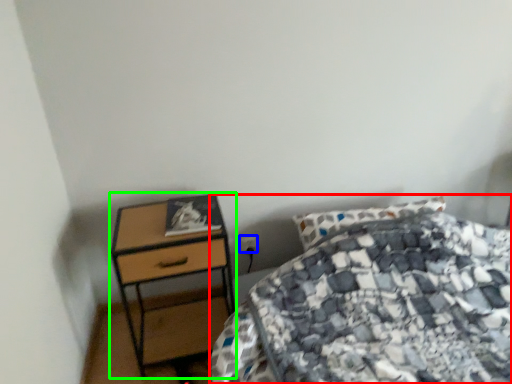
Question: Which is nearer to the bed (highlighted by a red box)? power plugs and sockets (highlighted by a blue box) or nightstand (highlighted by a green box).

Choices:
 (A) power plugs and sockets
 (B) nightstand

Answer: (B)